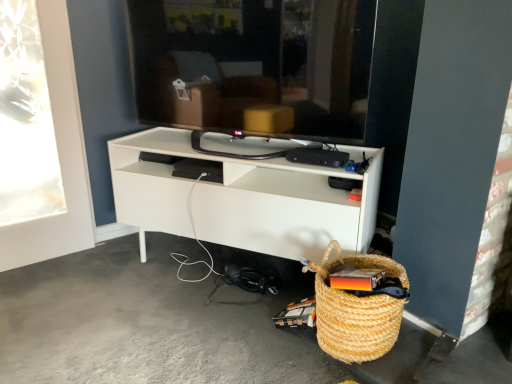
Image resolution: width=512 pixels, height=384 pixels. Find the location of `vacant area situated to the left side of woven straw basket at lower right`. vacant area situated to the left side of woven straw basket at lower right is located at coordinates (267, 349).